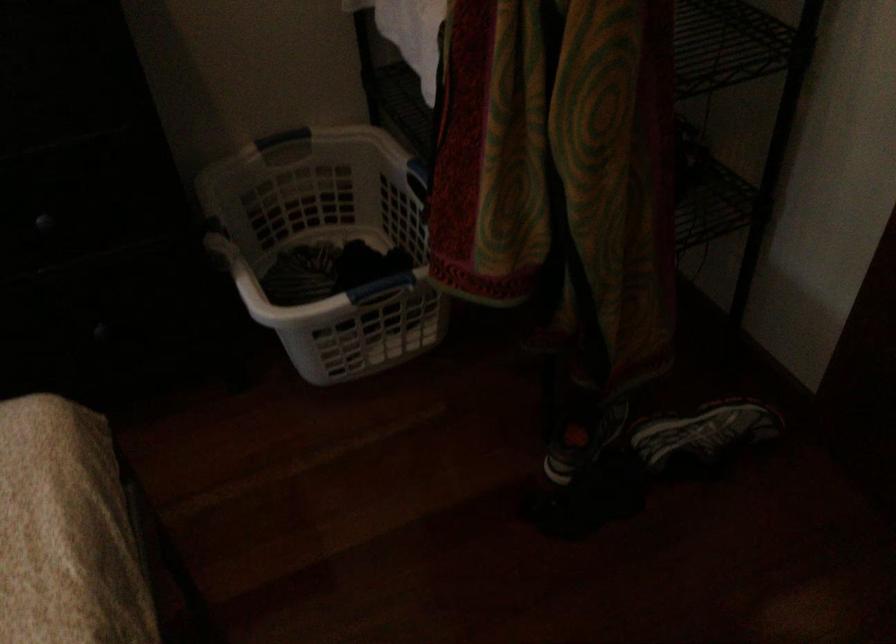
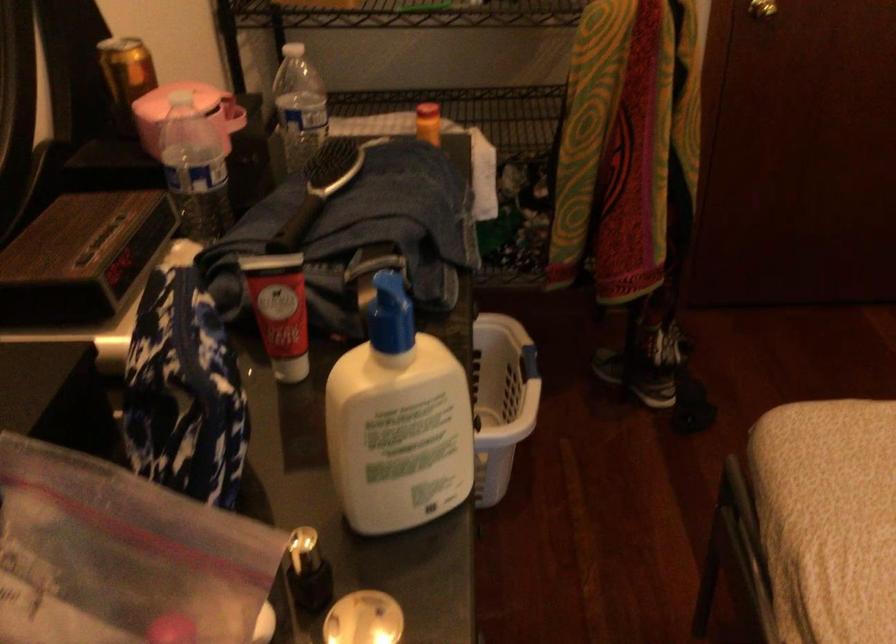
Question: I am providing you with two images of the same scene from different viewpoints. After the viewpoint changes to image2, which objects are now occluded?

Choices:
 (A) red lotion tube
 (B) laundry basket handle
 (C) blue basket handle
 (D) red appliance dial

Answer: (C)